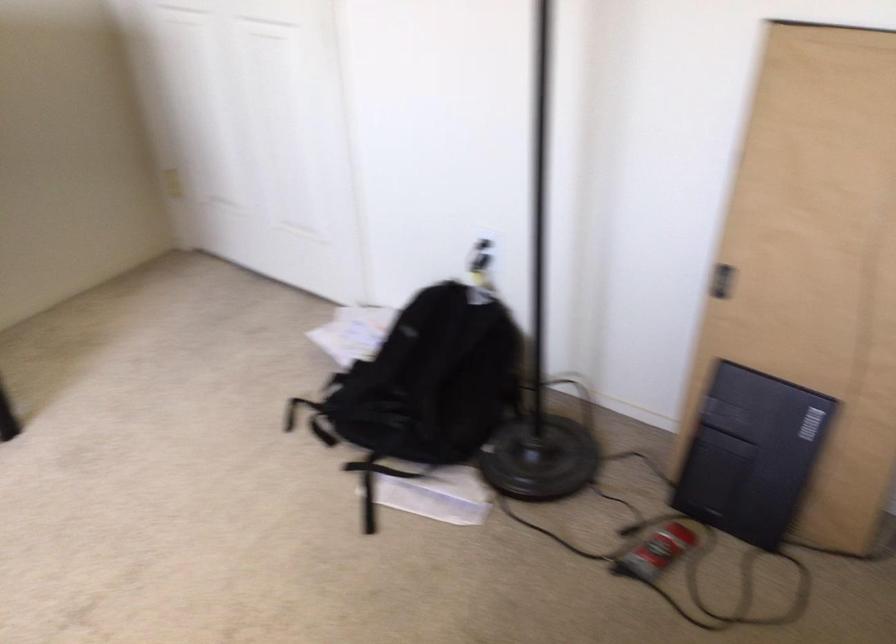
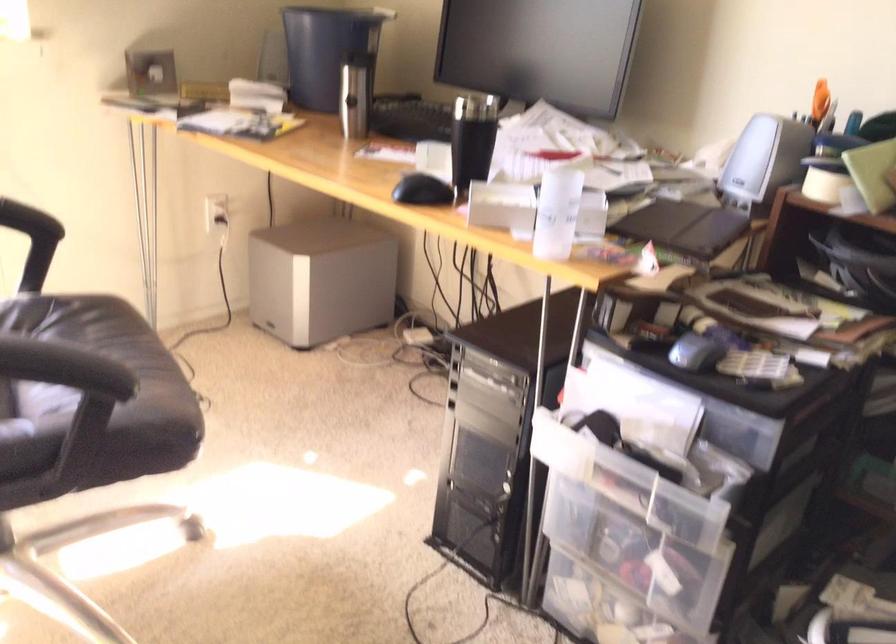
How did the camera likely rotate?

The camera rotated toward left-down.